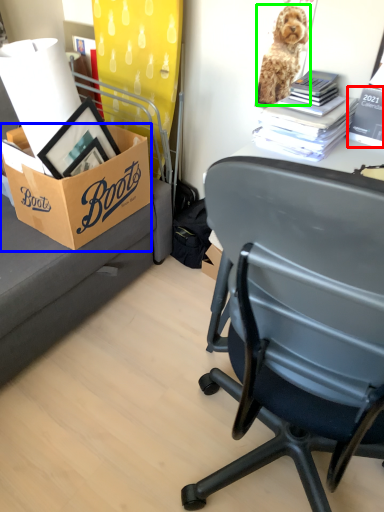
Question: Based on their relative distances, which object is farther from book (highlighted by a red box)? Choose from box (highlighted by a blue box) and dog (highlighted by a green box).

Choices:
 (A) box
 (B) dog

Answer: (A)